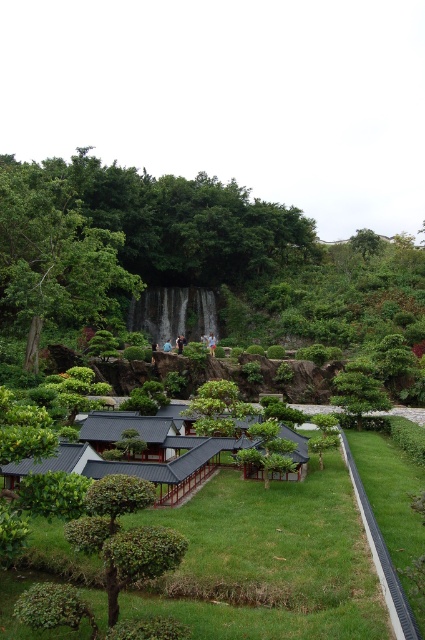
You are a gardener planning to trim the green leafy tree at left and the green leafy tree at upper center. Based on their positions, which tree might require a taller ladder to reach its branches?

The green leafy tree at upper center requires a taller ladder because it is positioned above the green leafy tree at left, indicating it is taller.

You are standing in the garden and want to walk to both the point at coordinates point (x=39, y=332) and point (x=368, y=240). Which point should you visit first to minimize the distance walked?

You should visit point (x=39, y=332) first because it is closer to you than point (x=368, y=240).